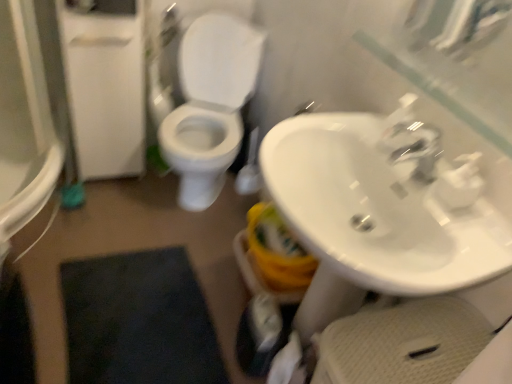
Question: From a real-world perspective, is white matte toilet paper at lower center physically above white glossy toilet at center?

Choices:
 (A) yes
 (B) no

Answer: (B)

Question: Are white matte toilet paper at lower center and white glossy toilet at center located far from each other?

Choices:
 (A) yes
 (B) no

Answer: (A)

Question: Is white matte toilet paper at lower center smaller than white glossy toilet at center?

Choices:
 (A) yes
 (B) no

Answer: (A)

Question: From a real-world perspective, is white matte toilet paper at lower center below white glossy toilet at center?

Choices:
 (A) no
 (B) yes

Answer: (B)

Question: Is the depth of white matte toilet paper at lower center less than that of white glossy toilet at center?

Choices:
 (A) yes
 (B) no

Answer: (A)

Question: From the image's perspective, is white matte toilet paper at lower center located above or below white glossy sink at center right?

Choices:
 (A) above
 (B) below

Answer: (B)

Question: Considering their positions, is white matte toilet paper at lower center located in front of or behind white glossy sink at center right?

Choices:
 (A) front
 (B) behind

Answer: (B)

Question: Choose the correct answer: Is white matte toilet paper at lower center inside white glossy sink at center right or outside it?

Choices:
 (A) inside
 (B) outside

Answer: (B)

Question: In the image, is white matte toilet paper at lower center on the left side or the right side of white glossy sink at center right?

Choices:
 (A) left
 (B) right

Answer: (A)

Question: Would you say white glossy toilet at center is to the left or to the right of white glossy sink at center right in the picture?

Choices:
 (A) right
 (B) left

Answer: (B)

Question: Looking at the image, does white glossy toilet at center seem bigger or smaller compared to white glossy sink at center right?

Choices:
 (A) big
 (B) small

Answer: (A)

Question: From the image's perspective, is white glossy toilet at center above or below white glossy sink at center right?

Choices:
 (A) above
 (B) below

Answer: (A)

Question: Considering their positions, is white glossy toilet at center located in front of or behind white glossy sink at center right?

Choices:
 (A) behind
 (B) front

Answer: (A)

Question: From a real-world perspective, relative to white matte toilet paper at lower center, is white glossy toilet at center vertically above or below?

Choices:
 (A) below
 (B) above

Answer: (B)

Question: Is white glossy toilet at center taller or shorter than white matte toilet paper at lower center?

Choices:
 (A) short
 (B) tall

Answer: (B)